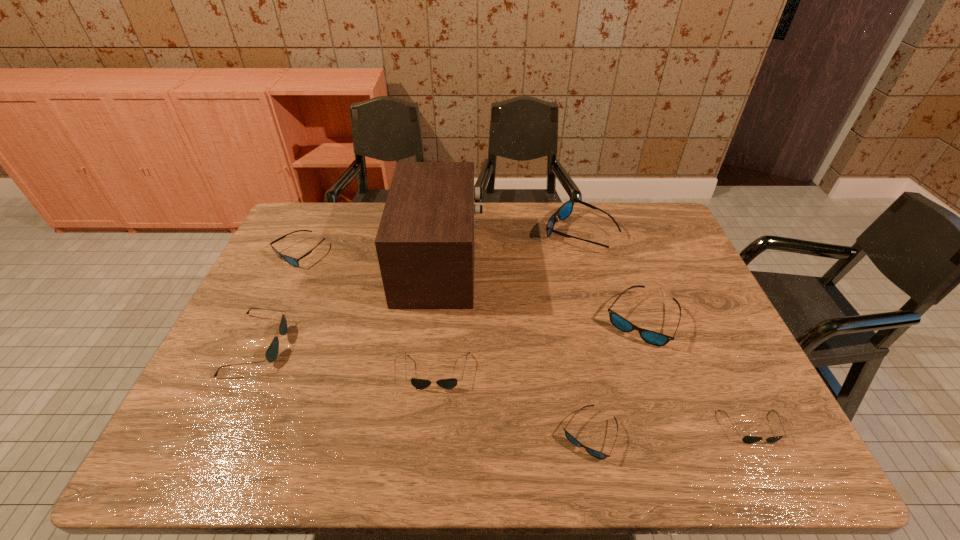
Identify which object is the closest to the nearest blue sunglasses. Please provide its 2D coordinates. Your answer should be formatted as a tuple, i.e. [(x, y)], where the tuple contains the x and y coordinates of a point satisfying the conditions above.

[(654, 338)]

The image size is (960, 540). In order to click on sunglasses that is the second closest to the nearest blue sunglasses in this screenshot , I will do `click(450, 383)`.

Identify which sunglasses is the closest to the second biggest blue sunglasses. Please provide its 2D coordinates. Your answer should be formatted as a tuple, i.e. [(x, y)], where the tuple contains the x and y coordinates of a point satisfying the conditions above.

[(565, 210)]

This screenshot has width=960, height=540. What are the coordinates of `blue sunglasses that is the third nearest to the smallest black sunglasses` in the screenshot? It's located at (565, 210).

Identify the location of blue sunglasses object that ranks as the second closest to the third biggest blue sunglasses. The height and width of the screenshot is (540, 960). (574, 441).

Locate an element on the screen. This screenshot has width=960, height=540. the closest black sunglasses to the rightmost black sunglasses is located at coordinates (450, 383).

Identify which black sunglasses is located as the nearest to the second biggest black sunglasses. Please provide its 2D coordinates. Your answer should be formatted as a tuple, i.e. [(x, y)], where the tuple contains the x and y coordinates of a point satisfying the conditions above.

[(271, 354)]

In order to click on free space that satisfies the following two spatial constraints: 1. at the front of the second tallest object showing the lenses; 2. at the front of the second smallest blue sunglasses showing the lenses in this screenshot , I will do `click(585, 252)`.

At what (x,y) coordinates should I click in order to perform the action: click on free space that satisfies the following two spatial constraints: 1. at the front of the tallest sunglasses showing the lenses; 2. at the front of the second smallest blue sunglasses showing the lenses. Please return your answer as a coordinate pair (x, y). Looking at the image, I should click on (585, 252).